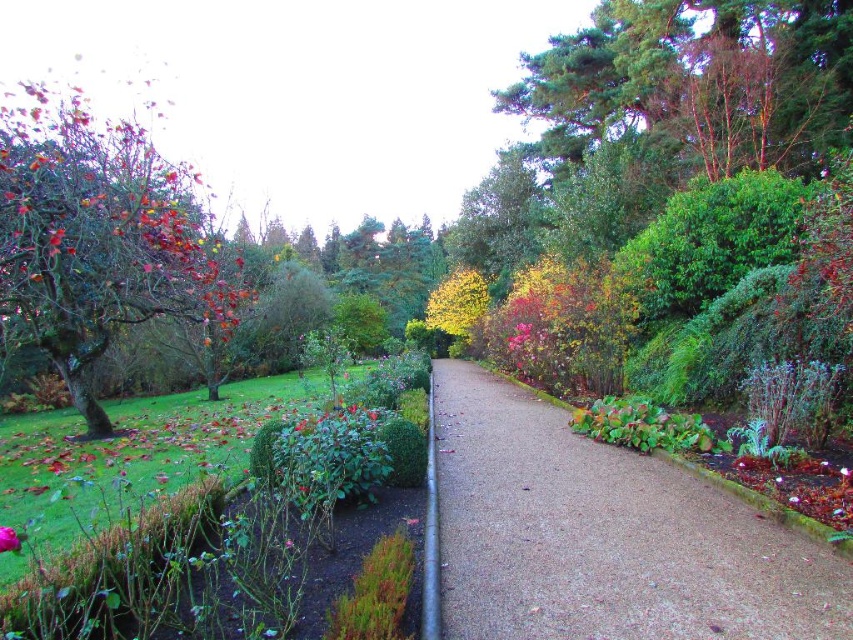
Does gravel at center come in front of purple matte flower at lower left?

No, gravel at center is behind purple matte flower at lower left.

Who is more distant from viewer, (570,602) or (4,525)?

The point (4,525) is behind.

Which is in front, point (474, 368) or point (18, 538)?

Point (18, 538) is more forward.

The image size is (853, 640). Identify the location of gravel at center. (605, 536).

Does point (434, 412) come closer to viewer compared to point (216, 346)?

Yes, it is in front of point (216, 346).

Can you confirm if gravel at center is positioned to the left of autumn leaves at left?

No, gravel at center is not to the left of autumn leaves at left.

Is point (666, 472) positioned before point (125, 124)?

Yes, it is in front of point (125, 124).

This screenshot has height=640, width=853. I want to click on gravel at center, so click(605, 536).

Who is lower down, autumn leaves at left or purple matte flower at lower left?

Positioned lower is purple matte flower at lower left.

Which is in front, point (22, 288) or point (7, 536)?

Positioned in front is point (7, 536).

Describe the element at coordinates (102, 241) in the screenshot. I see `autumn leaves at left` at that location.

Locate an element on the screen. The height and width of the screenshot is (640, 853). autumn leaves at left is located at coordinates (102, 241).